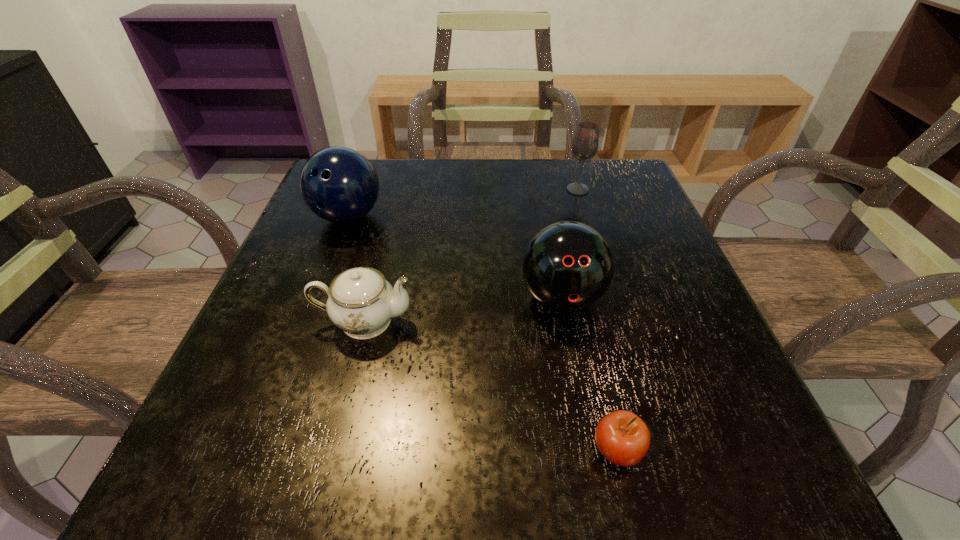
Locate an element on the screen. The width and height of the screenshot is (960, 540). vacant point located between the farther bowling ball and the glass drink container is located at coordinates (463, 203).

In order to click on vacant region between the right bowling ball and the shortest object in this screenshot , I will do `click(589, 374)`.

Locate an element on the screen. This screenshot has height=540, width=960. free space that is in between the nearer bowling ball and the chinaware is located at coordinates (463, 309).

Where is `vacant point located between the nearest object and the chinaware`? The image size is (960, 540). vacant point located between the nearest object and the chinaware is located at coordinates click(491, 386).

The width and height of the screenshot is (960, 540). I want to click on free area in between the second shortest object and the apple, so click(x=491, y=386).

Locate an element on the screen. The width and height of the screenshot is (960, 540). free space that is in between the second shortest object and the farthest object is located at coordinates (471, 255).

This screenshot has height=540, width=960. I want to click on object that is the fourth closest to the nearer bowling ball, so click(x=339, y=184).

Locate an element on the screen. This screenshot has width=960, height=540. the fourth closest object to the glass drink container is located at coordinates (622, 437).

At what (x,y) coordinates should I click in order to perform the action: click on vacant space that satisfies the following two spatial constraints: 1. on the surface of the nearest object near the finger holes; 2. on the right side of the fourth nearest object. Please return your answer as a coordinate pair (x, y). Looking at the image, I should click on (260, 450).

At what (x,y) coordinates should I click in order to perform the action: click on free space that satisfies the following two spatial constraints: 1. on the surface of the right bowling ball near the finger holes; 2. at the spout of the fourth tallest object. Please return your answer as a coordinate pair (x, y). The image size is (960, 540). Looking at the image, I should click on (565, 321).